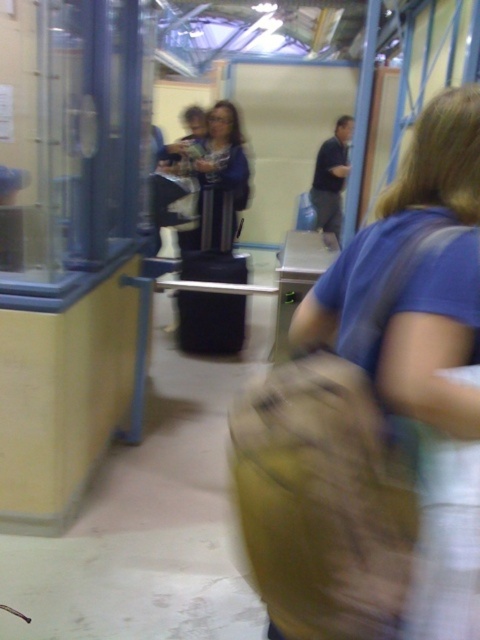
What do you see at coordinates (399, 216) in the screenshot? The height and width of the screenshot is (640, 480). I see `brown fabric bag at center` at bounding box center [399, 216].

Does brown fabric bag at center have a lesser width compared to blue fabric jacket at center?

Indeed, brown fabric bag at center has a lesser width compared to blue fabric jacket at center.

The image size is (480, 640). In order to click on brown fabric bag at center in this screenshot , I will do `click(399, 216)`.